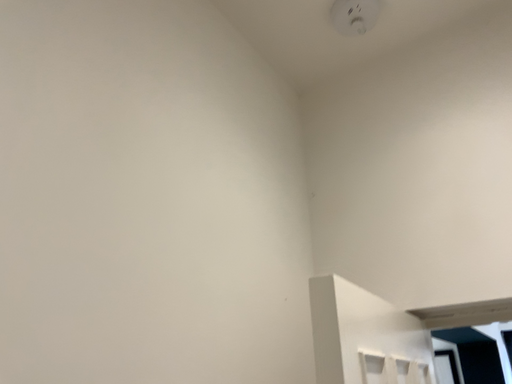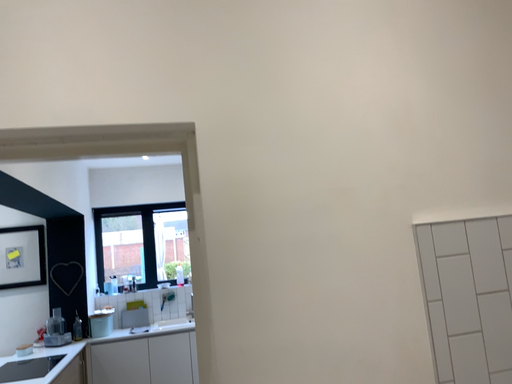
Question: How did the camera likely rotate when shooting the video?

Choices:
 (A) rotated upward
 (B) rotated downward

Answer: (B)